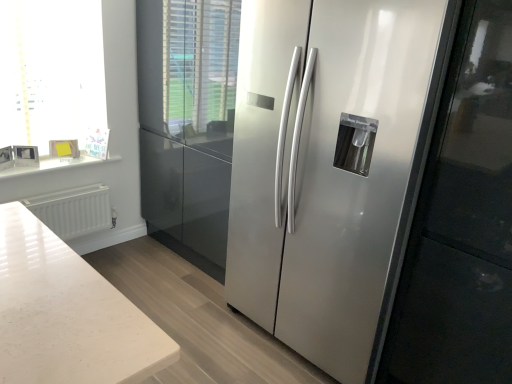
Question: In terms of width, does white glossy frame at upper left look wider or thinner when compared to satin silver refrigerator at center?

Choices:
 (A) thin
 (B) wide

Answer: (A)

Question: From the image's perspective, is white glossy frame at upper left positioned above or below satin silver refrigerator at center?

Choices:
 (A) below
 (B) above

Answer: (B)

Question: Estimate the real-world distances between objects in this image. Which object is closer to the white glossy frame at upper left?

Choices:
 (A) satin silver refrigerator at center
 (B) white marble counter top at upper left
 (C) white matte radiator at lower left

Answer: (B)

Question: Estimate the real-world distances between objects in this image. Which object is farther from the satin silver refrigerator at center?

Choices:
 (A) white matte radiator at lower left
 (B) white glossy frame at upper left
 (C) white marble counter top at upper left

Answer: (C)